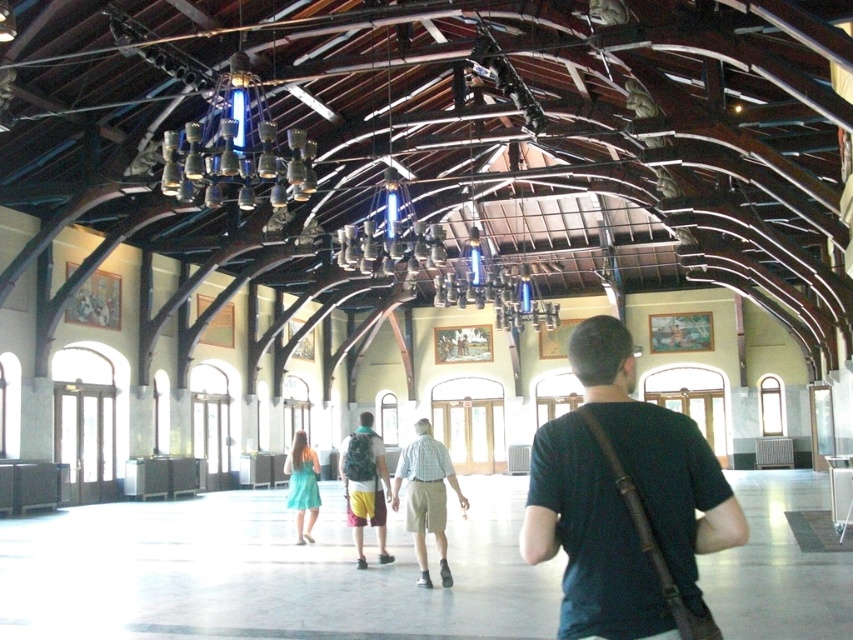
You are standing in the hall and see both the light blue plaid shirt at center and the teal fabric dress at center. Which one is closer to you?

The light blue plaid shirt at center is closer because it is in front of the teal fabric dress at center.

You are a security guard in the hall and notice two bags left unattended at the center. Which bag is on the right side of the other? The bags are the black leather bag at center and the camouflage backpack at center.

The black leather bag at center is positioned on the right side of the camouflage backpack at center.

You are standing in the hall and see both the black leather bag at center and the light blue plaid shirt at center. Which object is positioned to the right of the other?

The black leather bag at center is to the right of the light blue plaid shirt at center.